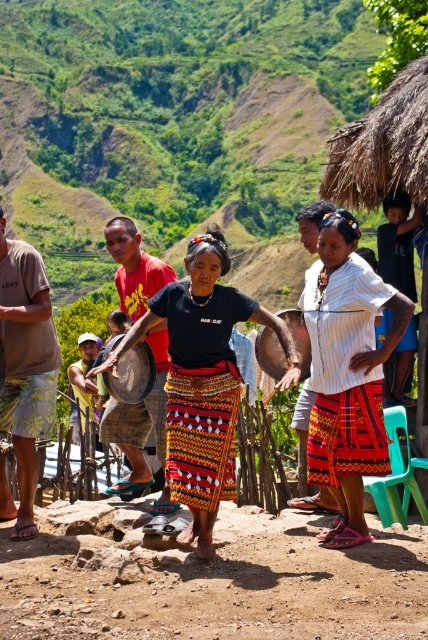
You are observing a cultural performance and notice two items at the center of the scene. Which item is positioned to the left of the other? The items are the multicolored woven skirt at center and the shiny metallic drum at center.

The shiny metallic drum at center is positioned to the left of the multicolored woven skirt at center.

You are a photographer trying to capture the cultural attire of the women in the scene. Based on the image, which object is closer to the camera between the multicolored woven skirt at center and the shiny metallic drum at center?

The multicolored woven skirt at center is positioned under the shiny metallic drum at center, so the shiny metallic drum at center is closer to the camera.